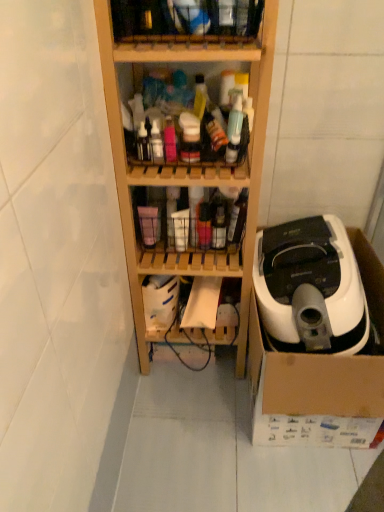
What do you see at coordinates (185, 179) in the screenshot? The image size is (384, 512). I see `wooden shelf at center, positioned as the second shelf in bottom-to-top order` at bounding box center [185, 179].

Describe the element at coordinates (188, 228) in the screenshot. I see `translucent plastic bottles at center, acting as the 4th shelf starting from the top` at that location.

Describe the element at coordinates (310, 287) in the screenshot. I see `white plastic vacuum cleaner at right` at that location.

The height and width of the screenshot is (512, 384). What do you see at coordinates (191, 345) in the screenshot?
I see `black rubber wire at lower center` at bounding box center [191, 345].

Based on the photo, measure the distance between black rubber wire at lower center and camera.

The distance of black rubber wire at lower center from camera is 1.39 meters.

Where is `wooden shelf at center, which appears as the third shelf when viewed from the top`? This screenshot has width=384, height=512. wooden shelf at center, which appears as the third shelf when viewed from the top is located at coordinates (185, 179).

Consider the image. What's the angular difference between white plastic vacuum cleaner at right and translucent plastic bottles at center, acting as the 4th shelf starting from the top,'s facing directions?

The angular difference between white plastic vacuum cleaner at right and translucent plastic bottles at center, acting as the 4th shelf starting from the top, is 0.274 degrees.

Could you tell me if white plastic vacuum cleaner at right is turned towards translucent plastic bottles at center, which is counted as the 1th shelf, starting from the bottom?

No, white plastic vacuum cleaner at right does not turn towards translucent plastic bottles at center, which is counted as the 1th shelf, starting from the bottom.

Which object is thinner, white plastic vacuum cleaner at right or translucent plastic bottles at center, acting as the 4th shelf starting from the top?

With smaller width is translucent plastic bottles at center, acting as the 4th shelf starting from the top.

Is white plastic vacuum cleaner at right beside translucent plastic bottles at center, which is counted as the 1th shelf, starting from the bottom?

No.

From the image's perspective, which is above, translucent plastic bottles at center, acting as the 4th shelf starting from the top, or black rubber wire at lower center?

translucent plastic bottles at center, acting as the 4th shelf starting from the top, from the image's perspective.

I want to click on wire located behind the translucent plastic bottles at center, acting as the 4th shelf starting from the top, so click(x=191, y=345).

From a real-world perspective, is black rubber wire at lower center below wooden shelf at upper center, positioned as the first shelf in top-to-bottom order?

Yes.

Is point (180, 331) closer or farther from the camera than point (170, 7)?

Point (180, 331) is positioned farther from the camera compared to point (170, 7).

Consider the image. What's the angular difference between black rubber wire at lower center and wooden shelf at upper center, which is the fourth shelf in bottom-to-top order,'s facing directions?

The angular difference between black rubber wire at lower center and wooden shelf at upper center, which is the fourth shelf in bottom-to-top order, is 0.528 degrees.

From the image's perspective, is black rubber wire at lower center above wooden shelf at upper center, which is the fourth shelf in bottom-to-top order?

Incorrect, from the image's perspective, black rubber wire at lower center is lower than wooden shelf at upper center, which is the fourth shelf in bottom-to-top order.

The image size is (384, 512). Identify the location of the 3rd shelf directly above the black rubber wire at lower center (from a real-world perspective). (186, 118).

Can you confirm if translucent plastic bottles at center, which is counted as the 3th shelf, starting from the bottom, is shorter than black rubber wire at lower center?

Yes, translucent plastic bottles at center, which is counted as the 3th shelf, starting from the bottom, is shorter than black rubber wire at lower center.

Choose the correct answer: Is translucent plastic bottles at center, which is counted as the 3th shelf, starting from the bottom, inside black rubber wire at lower center or outside it?

translucent plastic bottles at center, which is counted as the 3th shelf, starting from the bottom, is not enclosed by black rubber wire at lower center.

Is translucent plastic bottles at center, placed as the second shelf when sorted from top to bottom, in front of or behind black rubber wire at lower center in the image?

translucent plastic bottles at center, placed as the second shelf when sorted from top to bottom, is in front of black rubber wire at lower center.

Can you confirm if black rubber wire at lower center is thinner than wooden shelf at center, positioned as the second shelf in bottom-to-top order?

Yes, black rubber wire at lower center is thinner than wooden shelf at center, positioned as the second shelf in bottom-to-top order.

Does black rubber wire at lower center turn towards wooden shelf at center, positioned as the second shelf in bottom-to-top order?

Yes, black rubber wire at lower center is facing wooden shelf at center, positioned as the second shelf in bottom-to-top order.

Can we say black rubber wire at lower center lies outside wooden shelf at center, which appears as the third shelf when viewed from the top?

Actually, black rubber wire at lower center is within wooden shelf at center, which appears as the third shelf when viewed from the top.

Relative to wooden shelf at upper center, positioned as the first shelf in top-to-bottom order, is white plastic vacuum cleaner at right in front or behind?

In the image, white plastic vacuum cleaner at right appears behind wooden shelf at upper center, positioned as the first shelf in top-to-bottom order.

Is white plastic vacuum cleaner at right facing towards wooden shelf at upper center, which is the fourth shelf in bottom-to-top order?

No, white plastic vacuum cleaner at right does not turn towards wooden shelf at upper center, which is the fourth shelf in bottom-to-top order.

From the image's perspective, which shelf is the 4th one above the white plastic vacuum cleaner at right? Please provide its 2D coordinates.

[(186, 20)]

Looking at this image, how different are the orientations of white plastic vacuum cleaner at right and black rubber wire at lower center in degrees?

The angle between the facing direction of white plastic vacuum cleaner at right and the facing direction of black rubber wire at lower center is 1.19 degrees.

Is white plastic vacuum cleaner at right aimed at black rubber wire at lower center?

No, white plastic vacuum cleaner at right does not turn towards black rubber wire at lower center.

Are white plastic vacuum cleaner at right and black rubber wire at lower center making contact?

No, white plastic vacuum cleaner at right is not making contact with black rubber wire at lower center.

The width and height of the screenshot is (384, 512). I want to click on wire that appears on the left of white plastic vacuum cleaner at right, so click(x=191, y=345).

Locate an element on the screen. Image resolution: width=384 pixels, height=512 pixels. the 1st shelf above when counting from the white plastic vacuum cleaner at right (from the image's perspective) is located at coordinates (188, 228).

The height and width of the screenshot is (512, 384). Find the location of `wire below the translucent plastic bottles at center, acting as the 4th shelf starting from the top (from the image's perspective)`. wire below the translucent plastic bottles at center, acting as the 4th shelf starting from the top (from the image's perspective) is located at coordinates (191, 345).

Estimate the real-world distances between objects in this image. Which object is closer to translucent plastic bottles at center, which is counted as the 1th shelf, starting from the bottom, white plastic vacuum cleaner at right or black rubber wire at lower center?

Among the two, white plastic vacuum cleaner at right is located nearer to translucent plastic bottles at center, which is counted as the 1th shelf, starting from the bottom.

Estimate the real-world distances between objects in this image. Which object is closer to translucent plastic bottles at center, which is counted as the 3th shelf, starting from the bottom, black rubber wire at lower center or wooden shelf at upper center, which is the fourth shelf in bottom-to-top order?

Among the two, wooden shelf at upper center, which is the fourth shelf in bottom-to-top order, is located nearer to translucent plastic bottles at center, which is counted as the 3th shelf, starting from the bottom.

Based on their spatial positions, is wooden shelf at center, which appears as the third shelf when viewed from the top, or translucent plastic bottles at center, placed as the second shelf when sorted from top to bottom, further from white plastic vacuum cleaner at right?

Among the two, translucent plastic bottles at center, placed as the second shelf when sorted from top to bottom, is located further to white plastic vacuum cleaner at right.

Based on their spatial positions, is black rubber wire at lower center or white plastic vacuum cleaner at right closer to translucent plastic bottles at center, which is counted as the 3th shelf, starting from the bottom?

Among the two, white plastic vacuum cleaner at right is located nearer to translucent plastic bottles at center, which is counted as the 3th shelf, starting from the bottom.

From the image, which object appears to be nearer to translucent plastic bottles at center, which is counted as the 1th shelf, starting from the bottom, translucent plastic bottles at center, which is counted as the 3th shelf, starting from the bottom, or black rubber wire at lower center?

The object closer to translucent plastic bottles at center, which is counted as the 1th shelf, starting from the bottom, is translucent plastic bottles at center, which is counted as the 3th shelf, starting from the bottom.

Considering their positions, is white plastic vacuum cleaner at right positioned closer to wooden shelf at upper center, which is the fourth shelf in bottom-to-top order, than wooden shelf at center, which appears as the third shelf when viewed from the top?

wooden shelf at center, which appears as the third shelf when viewed from the top.

Based on their spatial positions, is translucent plastic bottles at center, placed as the second shelf when sorted from top to bottom, or wooden shelf at center, positioned as the second shelf in bottom-to-top order, further from wooden shelf at upper center, positioned as the first shelf in top-to-bottom order?

Based on the image, wooden shelf at center, positioned as the second shelf in bottom-to-top order, appears to be further to wooden shelf at upper center, positioned as the first shelf in top-to-bottom order.

Which object lies further to the anchor point translucent plastic bottles at center, which is counted as the 1th shelf, starting from the bottom, black rubber wire at lower center or white plastic vacuum cleaner at right?

black rubber wire at lower center lies further to translucent plastic bottles at center, which is counted as the 1th shelf, starting from the bottom, than the other object.

This screenshot has width=384, height=512. In order to click on home appliance between wooden shelf at center, which appears as the third shelf when viewed from the top, and black rubber wire at lower center, along the z-axis in this screenshot , I will do `click(310, 287)`.

The image size is (384, 512). In order to click on home appliance between wooden shelf at upper center, positioned as the first shelf in top-to-bottom order, and black rubber wire at lower center, in the vertical direction in this screenshot , I will do `click(310, 287)`.

At what (x,y) coordinates should I click in order to perform the action: click on home appliance between translucent plastic bottles at center, placed as the second shelf when sorted from top to bottom, and black rubber wire at lower center in the up-down direction. Please return your answer as a coordinate pair (x, y). Looking at the image, I should click on (310, 287).

At what (x,y) coordinates should I click in order to perform the action: click on shelf that lies between wooden shelf at upper center, positioned as the first shelf in top-to-bottom order, and wooden shelf at center, which appears as the third shelf when viewed from the top, from top to bottom. Please return your answer as a coordinate pair (x, y). Looking at the image, I should click on (186, 118).